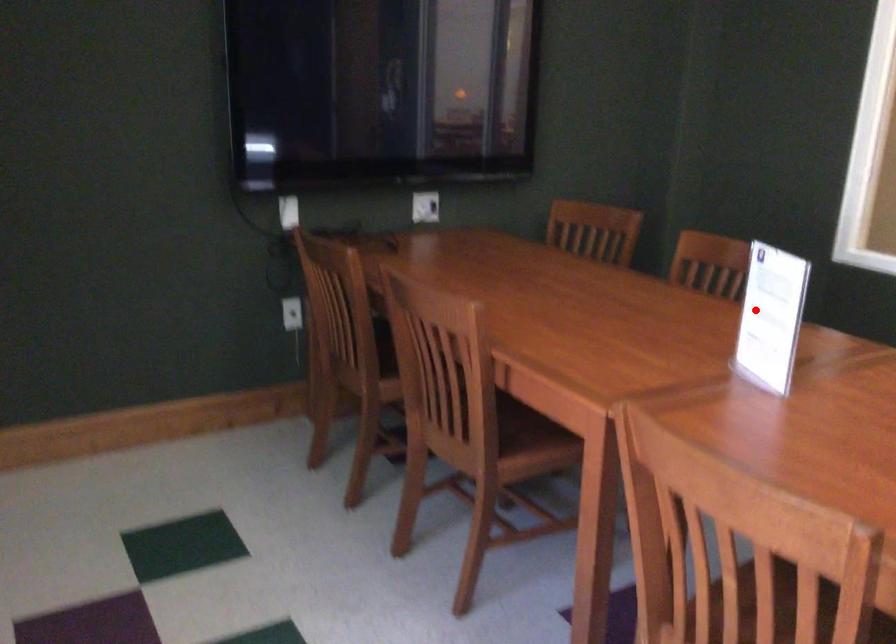
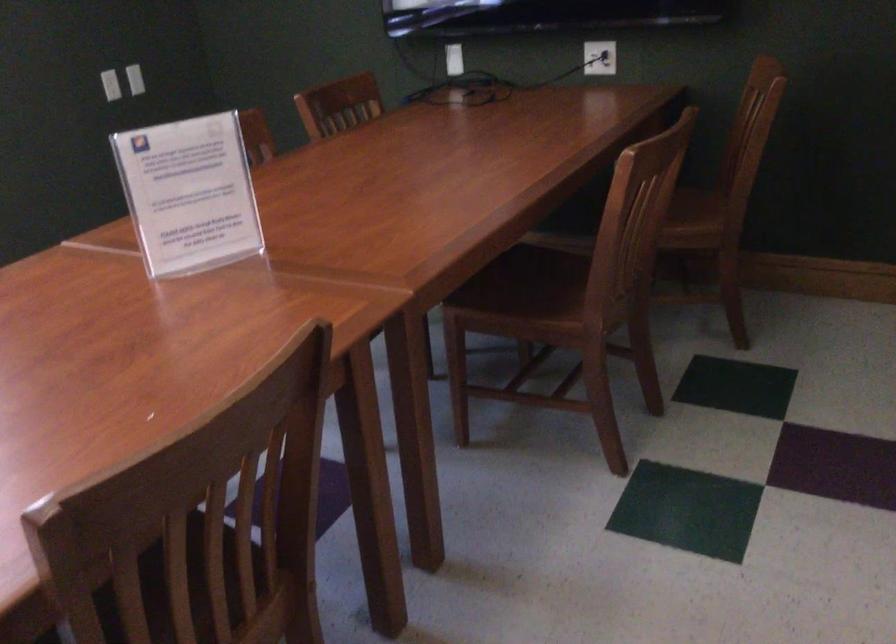
Find the pixel in the second image that matches the highlighted location in the first image.

(188, 194)